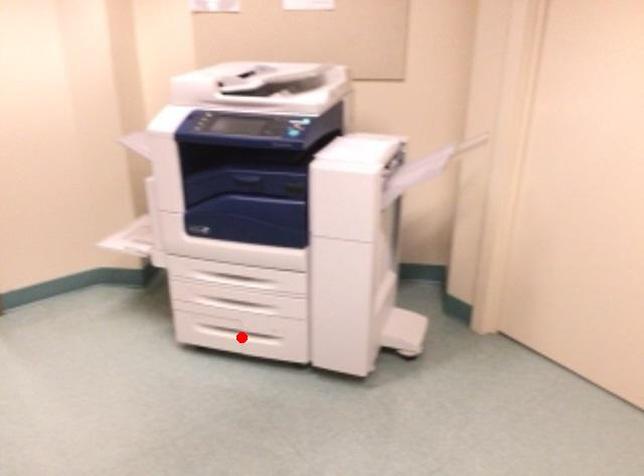
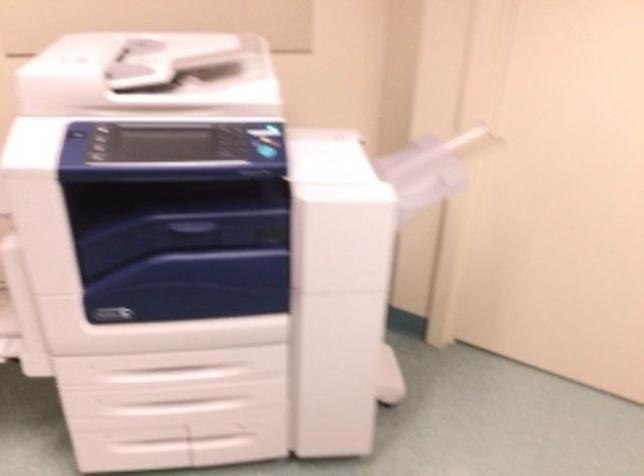
Question: I am providing you with two images of the same scene from different viewpoints. Given a red point in image1, look at the same physical point in image2. Is it:

Choices:
 (A) Closer to the viewpoint
 (B) Farther from the viewpoint

Answer: (A)